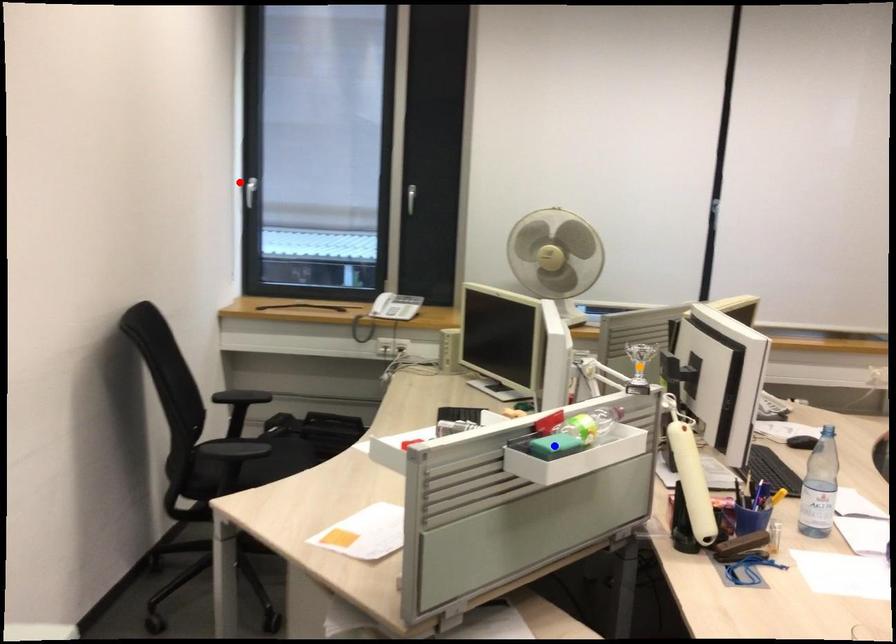
Order these from farthest to nearest:
1. orange point
2. red point
3. blue point

1. red point
2. orange point
3. blue point